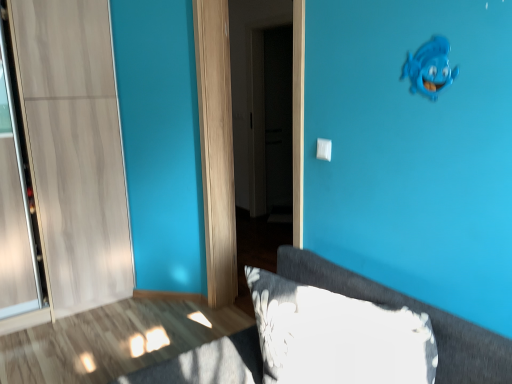
Question: From a real-world perspective, does blue matte fish at upper right sit lower than fluffy gray pillow at lower right?

Choices:
 (A) no
 (B) yes

Answer: (A)

Question: Does blue matte fish at upper right turn towards fluffy gray pillow at lower right?

Choices:
 (A) no
 (B) yes

Answer: (A)

Question: Is blue matte fish at upper right turned away from fluffy gray pillow at lower right?

Choices:
 (A) no
 (B) yes

Answer: (A)

Question: Considering the relative sizes of blue matte fish at upper right and fluffy gray pillow at lower right in the image provided, is blue matte fish at upper right wider than fluffy gray pillow at lower right?

Choices:
 (A) yes
 (B) no

Answer: (B)

Question: From the image's perspective, is blue matte fish at upper right on fluffy gray pillow at lower right?

Choices:
 (A) yes
 (B) no

Answer: (A)

Question: Is blue matte fish at upper right shorter than fluffy gray pillow at lower right?

Choices:
 (A) no
 (B) yes

Answer: (B)

Question: From the image's perspective, is white plastic light switch at center on top of blue matte fish at upper right?

Choices:
 (A) yes
 (B) no

Answer: (B)

Question: Is white plastic light switch at center outside of blue matte fish at upper right?

Choices:
 (A) yes
 (B) no

Answer: (A)

Question: Does white plastic light switch at center have a greater height compared to blue matte fish at upper right?

Choices:
 (A) yes
 (B) no

Answer: (B)

Question: From a real-world perspective, does white plastic light switch at center sit lower than blue matte fish at upper right?

Choices:
 (A) no
 (B) yes

Answer: (B)

Question: Can you confirm if white plastic light switch at center is smaller than blue matte fish at upper right?

Choices:
 (A) no
 (B) yes

Answer: (B)

Question: Can blue matte fish at upper right be found inside white plastic light switch at center?

Choices:
 (A) no
 (B) yes

Answer: (A)

Question: From the image's perspective, would you say white plastic light switch at center is shown under white glossy door at center?

Choices:
 (A) no
 (B) yes

Answer: (B)